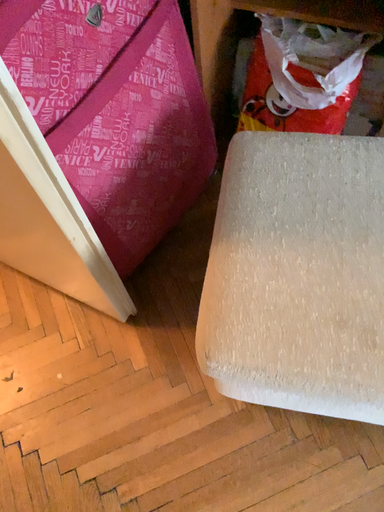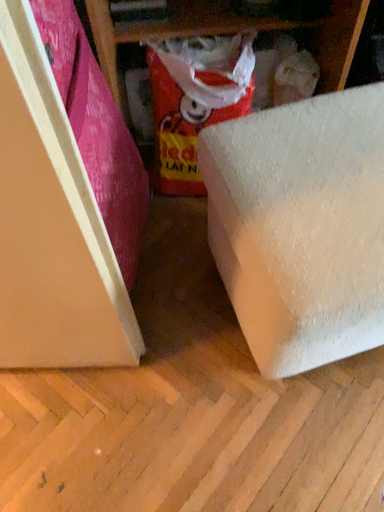
Question: How did the camera likely rotate when shooting the video?

Choices:
 (A) rotated upward
 (B) rotated downward

Answer: (A)